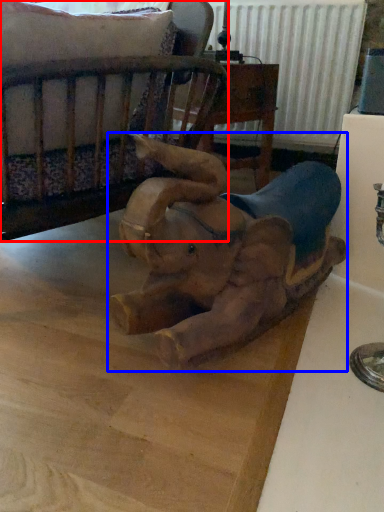
Question: Which point is closer to the camera, furniture (highlighted by a red box) or elephant (highlighted by a blue box)?

Choices:
 (A) furniture
 (B) elephant

Answer: (B)